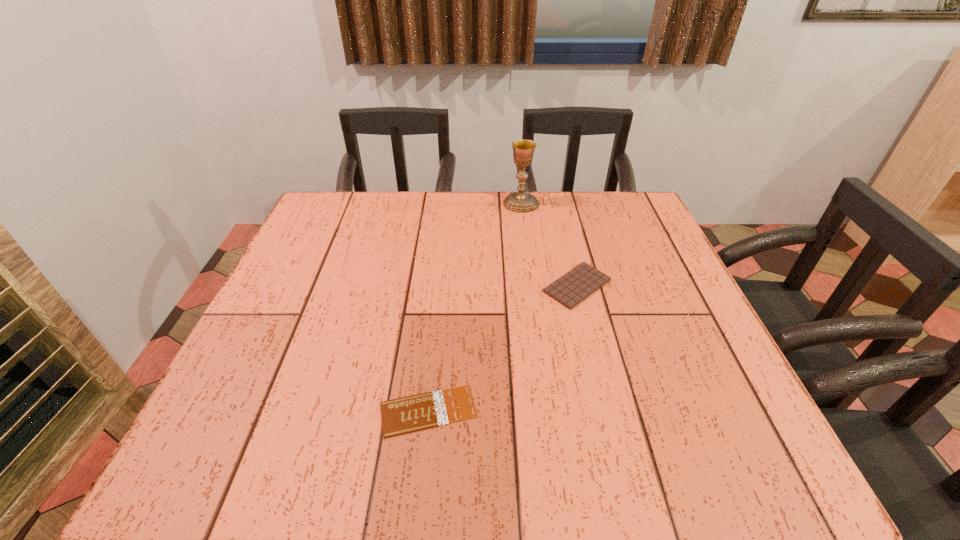
Where is `vacant space in between the second nearest object and the chalice`? This screenshot has height=540, width=960. vacant space in between the second nearest object and the chalice is located at coordinates (549, 245).

You are a GUI agent. You are given a task and a screenshot of the screen. Output one action in this format:
    pyautogui.click(x=<x>, y=<y>)
    Task: Click on the free point between the nearest object and the farther chocolate bar
    
    Given the screenshot: What is the action you would take?
    pyautogui.click(x=503, y=348)

Locate an element on the screen. This screenshot has height=540, width=960. vacant area that lies between the shorter chocolate bar and the second nearest object is located at coordinates (503, 348).

Where is `free space between the tallest object and the leftmost object`? free space between the tallest object and the leftmost object is located at coordinates (474, 307).

You are a GUI agent. You are given a task and a screenshot of the screen. Output one action in this format:
    pyautogui.click(x=<x>, y=<y>)
    Task: Click on the vacant area between the farther chocolate bar and the farthest object
    
    Given the screenshot: What is the action you would take?
    pyautogui.click(x=549, y=245)

Identify the location of vacant area that lies between the shorter chocolate bar and the farther chocolate bar. The width and height of the screenshot is (960, 540). (503, 348).

The width and height of the screenshot is (960, 540). Find the location of `free spot between the second farthest object and the farthest object`. free spot between the second farthest object and the farthest object is located at coordinates [549, 245].

This screenshot has width=960, height=540. Identify the location of the second closest object to the taller chocolate bar. (418, 412).

Identify the location of object that is the closest to the right chocolate bar. (523, 150).

Locate an element on the screen. Image resolution: width=960 pixels, height=540 pixels. vacant space that satisfies the following two spatial constraints: 1. on the back side of the taller chocolate bar; 2. on the right side of the shortest object is located at coordinates (441, 286).